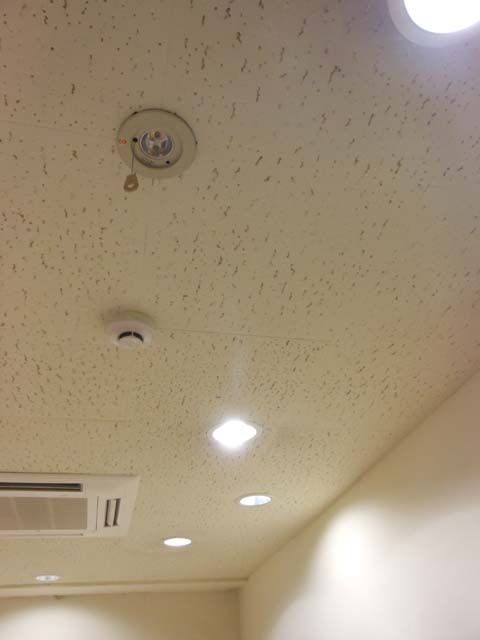
In order to click on vent in this screenshot , I will do tap(111, 516).